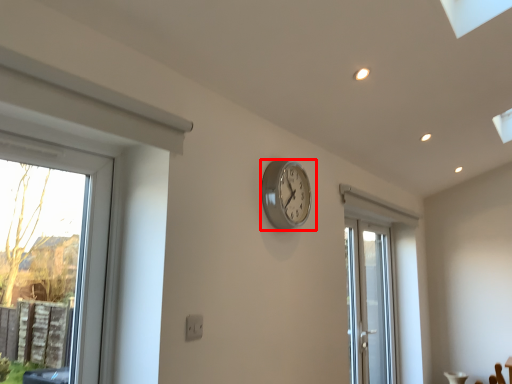
Question: From the image's perspective, considering the relative positions of wall clock (annotated by the red box) and door in the image provided, where is wall clock (annotated by the red box) located with respect to the staircase?

Choices:
 (A) above
 (B) below

Answer: (A)